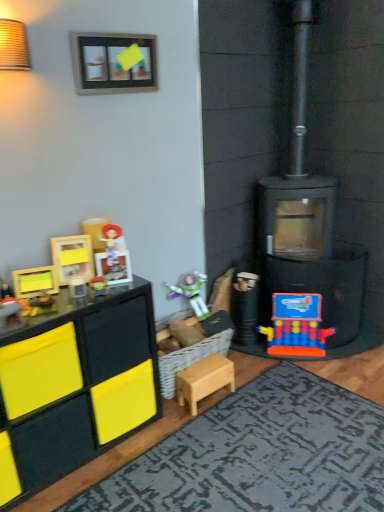
Describe the element at coordinates (13, 46) in the screenshot. I see `matte gold lampshade at upper left` at that location.

What do you see at coordinates (204, 380) in the screenshot?
I see `light wood stool at center, which is the 4th toy from left to right` at bounding box center [204, 380].

This screenshot has height=512, width=384. Identify the location of textured gray rug at lower center. (259, 454).

What's the angular difference between wooden picture frame at upper center and yellow matte toy at left, marked as the second toy in a front-to-back arrangement,'s facing directions?

The angle between the facing direction of wooden picture frame at upper center and the facing direction of yellow matte toy at left, marked as the second toy in a front-to-back arrangement, is 24.3 degrees.

Is wooden picture frame at upper center to the left of yellow matte toy at left, the fourth toy viewed from the back, from the viewer's perspective?

No.

From the image's perspective, is wooden picture frame at upper center above or below yellow matte toy at left, which appears as the fourth toy when viewed from the right?

Clearly, from the image's perspective, wooden picture frame at upper center is above yellow matte toy at left, which appears as the fourth toy when viewed from the right.

Could you tell me if wooden picture frame at upper center is turned towards yellow matte toy at left, marked as the second toy in a front-to-back arrangement?

No, wooden picture frame at upper center is not aimed at yellow matte toy at left, marked as the second toy in a front-to-back arrangement.

From a real-world perspective, who is located higher, yellow fabric drawer at left or orange plastic toy at lower right, arranged as the first toy when viewed from the back?

yellow fabric drawer at left is physically above.

Is yellow fabric drawer at left to the left or to the right of orange plastic toy at lower right, the first toy when ordered from right to left, in the image?

Based on their positions, yellow fabric drawer at left is located to the left of orange plastic toy at lower right, the first toy when ordered from right to left.

Is yellow fabric drawer at left oriented towards orange plastic toy at lower right, the first toy when ordered from right to left?

No, yellow fabric drawer at left is not turned towards orange plastic toy at lower right, the first toy when ordered from right to left.

Considering the sizes of objects yellow fabric drawer at left and orange plastic toy at lower right, the first toy when ordered from right to left, in the image provided, who is smaller, yellow fabric drawer at left or orange plastic toy at lower right, the first toy when ordered from right to left,?

orange plastic toy at lower right, the first toy when ordered from right to left, is smaller.

Considering the relative sizes of wooden picture frame at upper center and matte black toy at left, arranged as the 1th toy when viewed from the left, in the image provided, is wooden picture frame at upper center wider than matte black toy at left, arranged as the 1th toy when viewed from the left,?

No, wooden picture frame at upper center is not wider than matte black toy at left, arranged as the 1th toy when viewed from the left.

From a real-world perspective, does wooden picture frame at upper center stand above matte black toy at left, arranged as the 5th toy when viewed from the back?

Indeed, from a real-world perspective, wooden picture frame at upper center stands above matte black toy at left, arranged as the 5th toy when viewed from the back.

Between wooden picture frame at upper center and matte black toy at left, arranged as the 1th toy when viewed from the left, which one has more height?

wooden picture frame at upper center is taller.

Which of these two, yellow fabric drawer at left or wooden picture frame at upper center, is bigger?

yellow fabric drawer at left.

Consider the image. Are yellow fabric drawer at left and wooden picture frame at upper center located far from each other?

Yes.

Do you think yellow fabric drawer at left is within wooden picture frame at upper center, or outside of it?

yellow fabric drawer at left is not enclosed by wooden picture frame at upper center.

Is matte black toy at left, arranged as the 1th toy when viewed from the left, positioned in front of textured gray rug at lower center?

No, matte black toy at left, arranged as the 1th toy when viewed from the left, is further to the viewer.

Is point (11, 308) farther from camera compared to point (223, 489)?

Yes, point (11, 308) is farther from viewer.

From a real-world perspective, is matte black toy at left, arranged as the 5th toy when viewed from the back, physically located above or below textured gray rug at lower center?

matte black toy at left, arranged as the 5th toy when viewed from the back, is above textured gray rug at lower center.

Considering the relative sizes of matte black toy at left, arranged as the 1th toy when viewed from the left, and textured gray rug at lower center in the image provided, is matte black toy at left, arranged as the 1th toy when viewed from the left, wider than textured gray rug at lower center?

Incorrect, the width of matte black toy at left, arranged as the 1th toy when viewed from the left, does not surpass that of textured gray rug at lower center.

Is light wood stool at center, which is the 4th toy from left to right, looking in the opposite direction of textured gray rug at lower center?

No, light wood stool at center, which is the 4th toy from left to right,'s orientation is not away from textured gray rug at lower center.

How many degrees apart are the facing directions of light wood stool at center, which is the second toy from back to front, and textured gray rug at lower center?

91.5 degrees separate the facing orientations of light wood stool at center, which is the second toy from back to front, and textured gray rug at lower center.

In the scene shown: Considering the sizes of objects light wood stool at center, which is the 4th toy from left to right, and textured gray rug at lower center in the image provided, who is thinner, light wood stool at center, which is the 4th toy from left to right, or textured gray rug at lower center?

With smaller width is light wood stool at center, which is the 4th toy from left to right.

How different are the orientations of textured gray rug at lower center and yellow fabric drawer at left in degrees?

The angular difference between textured gray rug at lower center and yellow fabric drawer at left is 91.3 degrees.

Could you tell me if textured gray rug at lower center is facing yellow fabric drawer at left?

No, textured gray rug at lower center is not aimed at yellow fabric drawer at left.

From a real-world perspective, is textured gray rug at lower center physically below yellow fabric drawer at left?

Yes.

You are a GUI agent. You are given a task and a screenshot of the screen. Output one action in this format:
    pyautogui.click(x=<x>, y=<y>)
    Task: Click on the 2nd toy to the left when counting from the wooden picture frame at upper center
    Image resolution: width=384 pixels, height=512 pixels.
    Given the screenshot: What is the action you would take?
    pos(35,281)

From the image's perspective, which toy is the 1st one above the yellow fabric drawer at left? Please provide its 2D coordinates.

[(296, 326)]

Which object lies further to the anchor point textured gray rug at lower center, light wood stool at center, which is counted as the 4th toy, starting from the front, or wooden picture frame at upper center?

Among the two, wooden picture frame at upper center is located further to textured gray rug at lower center.

Considering their positions, is black matte fireplace at right positioned closer to wooden picture frame at upper center than yellow matte toy at left, which appears as the 2th toy when viewed from the left?

The object closer to wooden picture frame at upper center is yellow matte toy at left, which appears as the 2th toy when viewed from the left.

Based on their spatial positions, is matte gold lampshade at upper left or black matte fireplace at right further from wooden picture frame at upper center?

black matte fireplace at right.

When comparing their distances from light wood stool at center, which is the 4th toy from left to right, does black matte fireplace at right or wooden photo frame at upper left, the third toy positioned from the left, seem closer?

The object closer to light wood stool at center, which is the 4th toy from left to right, is black matte fireplace at right.

Consider the image. Based on their spatial positions, is light wood stool at center, which is the second toy from back to front, or yellow fabric drawer at left further from wooden photo frame at upper left, arranged as the third toy when viewed from the front?

light wood stool at center, which is the second toy from back to front, lies further to wooden photo frame at upper left, arranged as the third toy when viewed from the front, than the other object.

When comparing their distances from wooden photo frame at upper left, arranged as the third toy when viewed from the front, does matte black toy at left, arranged as the 5th toy when viewed from the back, or orange plastic toy at lower right, arranged as the first toy when viewed from the back, seem closer?

Based on the image, matte black toy at left, arranged as the 5th toy when viewed from the back, appears to be nearer to wooden photo frame at upper left, arranged as the third toy when viewed from the front.

Considering their positions, is orange plastic toy at lower right, the 5th toy from the front, positioned closer to matte black toy at left, placed as the first toy when sorted from front to back, than textured gray rug at lower center?

The object closer to matte black toy at left, placed as the first toy when sorted from front to back, is textured gray rug at lower center.

Estimate the real-world distances between objects in this image. Which object is further from wooden photo frame at upper left, arranged as the third toy when viewed from the front, wooden picture frame at upper center or textured gray rug at lower center?

textured gray rug at lower center is further to wooden photo frame at upper left, arranged as the third toy when viewed from the front.

Locate an element on the screen. mat between yellow fabric drawer at left and black matte fireplace at right from left to right is located at coordinates (259, 454).

At what (x,y) coordinates should I click in order to perform the action: click on furniture between matte gold lampshade at upper left and light wood stool at center, marked as the 2th toy in a right-to-left arrangement, in the vertical direction. Please return your answer as a coordinate pair (x, y). Image resolution: width=384 pixels, height=512 pixels. Looking at the image, I should click on (80, 382).

The height and width of the screenshot is (512, 384). What are the coordinates of `picture frame between yellow matte toy at left, which appears as the fourth toy when viewed from the right, and black matte fireplace at right from left to right` in the screenshot? It's located at (114, 62).

You are a GUI agent. You are given a task and a screenshot of the screen. Output one action in this format:
    pyautogui.click(x=<x>, y=<y>)
    Task: Click on the lamp that lies between wooden picture frame at upper center and wooden photo frame at upper left, marked as the third toy in a right-to-left arrangement, from top to bottom
    
    Given the screenshot: What is the action you would take?
    pyautogui.click(x=13, y=46)